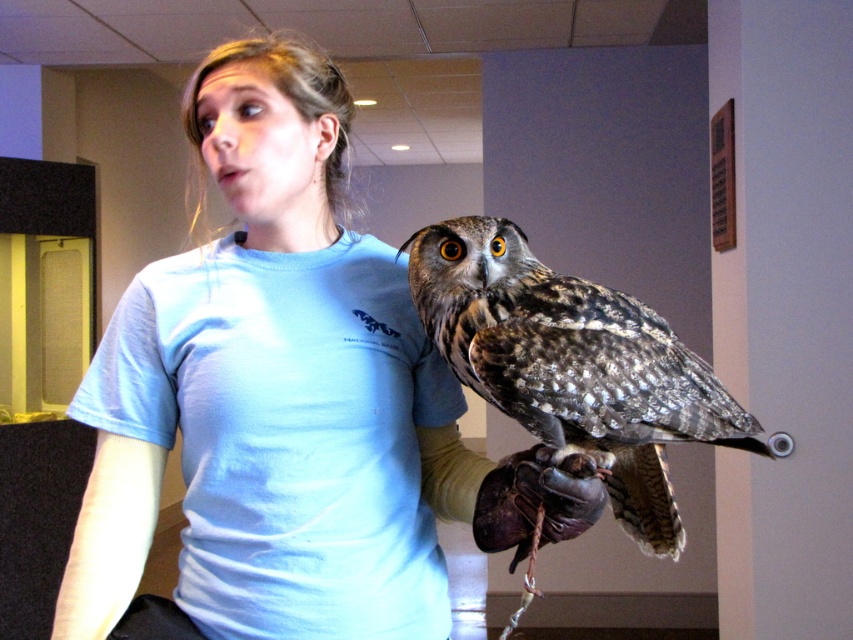
Question: Among these points, which one is farthest from the camera?

Choices:
 (A) (144, 340)
 (B) (543, 374)

Answer: (A)

Question: Can you confirm if speckled feathered owl at center is wider than light blue fabric at upper left?

Choices:
 (A) no
 (B) yes

Answer: (B)

Question: Observing the image, what is the correct spatial positioning of light blue t-shirt at center in reference to leather glove at center?

Choices:
 (A) left
 (B) right

Answer: (A)

Question: Does speckled feathered owl at center appear on the left side of leather glove at center?

Choices:
 (A) yes
 (B) no

Answer: (B)

Question: Which object is farther from the camera taking this photo?

Choices:
 (A) speckled feathered owl at center
 (B) leather glove at center
 (C) light blue fabric at upper left
 (D) light blue t-shirt at center

Answer: (C)

Question: Among these points, which one is farthest from the camera?

Choices:
 (A) (144, 444)
 (B) (215, 390)

Answer: (A)